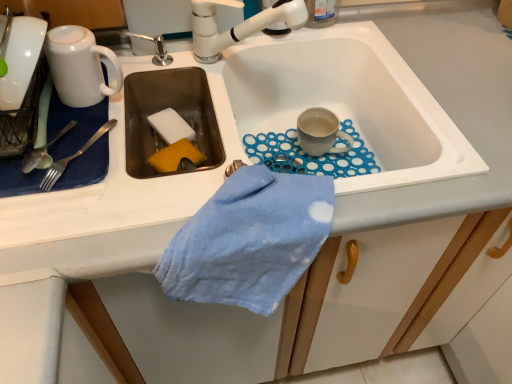
What are the coordinates of `vacant space in front of white glossy mug at upper left, which is counted as the 2th coffee cup, starting from the right` in the screenshot? It's located at (102, 169).